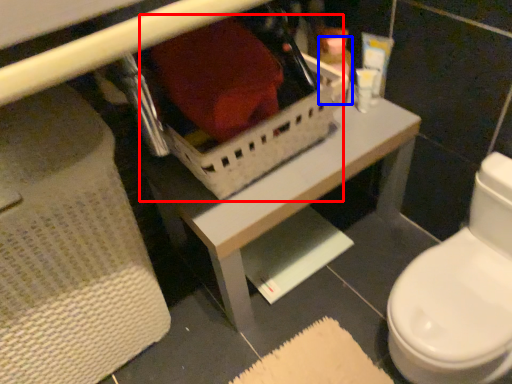
Question: Among these objects, which one is nearest to the camera, storage box (highlighted by a red box) or toiletry (highlighted by a blue box)?

Choices:
 (A) storage box
 (B) toiletry

Answer: (A)